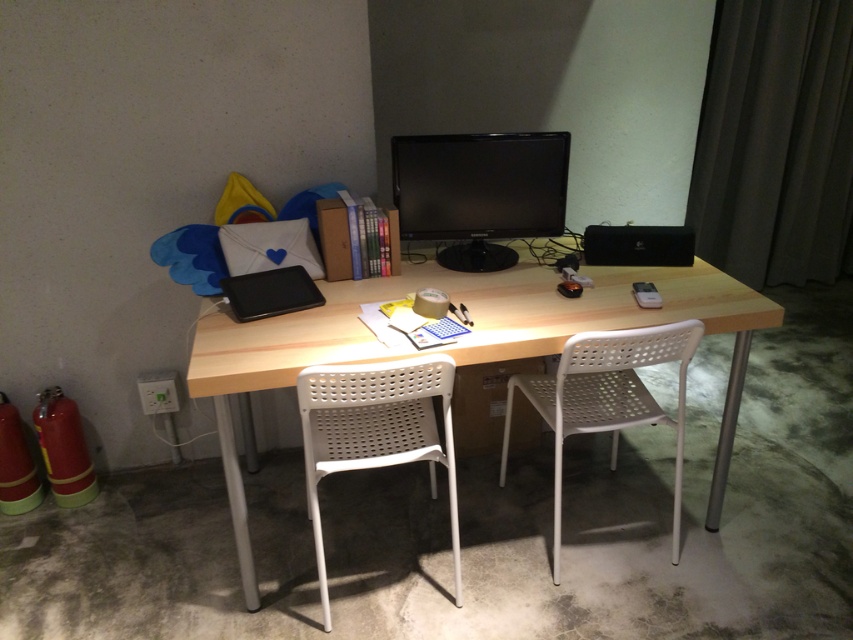
Between point (410, 234) and point (305, 369), which one is positioned behind?

Point (410, 234)

Is black glossy monitor at center to the left of white perforated chair at center from the viewer's perspective?

In fact, black glossy monitor at center is to the right of white perforated chair at center.

This screenshot has width=853, height=640. I want to click on black glossy monitor at center, so click(x=479, y=193).

Can you confirm if natural wood desk at center is positioned below white plastic chair at center?

No.

Locate an element on the screen. This screenshot has height=640, width=853. natural wood desk at center is located at coordinates (463, 340).

In the scene shown: Does natural wood desk at center have a lesser height compared to white perforated chair at center?

Incorrect, natural wood desk at center's height does not fall short of white perforated chair at center's.

Which is above, natural wood desk at center or white perforated chair at center?

Positioned higher is natural wood desk at center.

Locate an element on the screen. The width and height of the screenshot is (853, 640). natural wood desk at center is located at coordinates (463, 340).